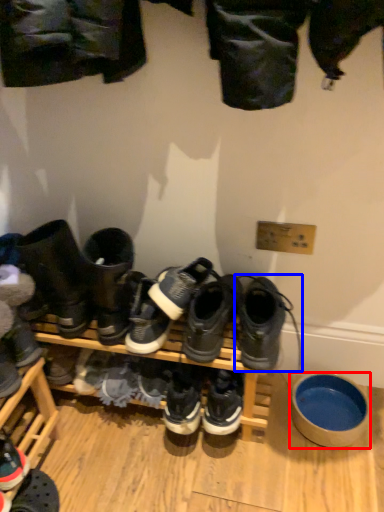
Question: Which object appears farthest to the camera in this image, bowl (highlighted by a red box) or footwear (highlighted by a blue box)?

Choices:
 (A) bowl
 (B) footwear

Answer: (A)